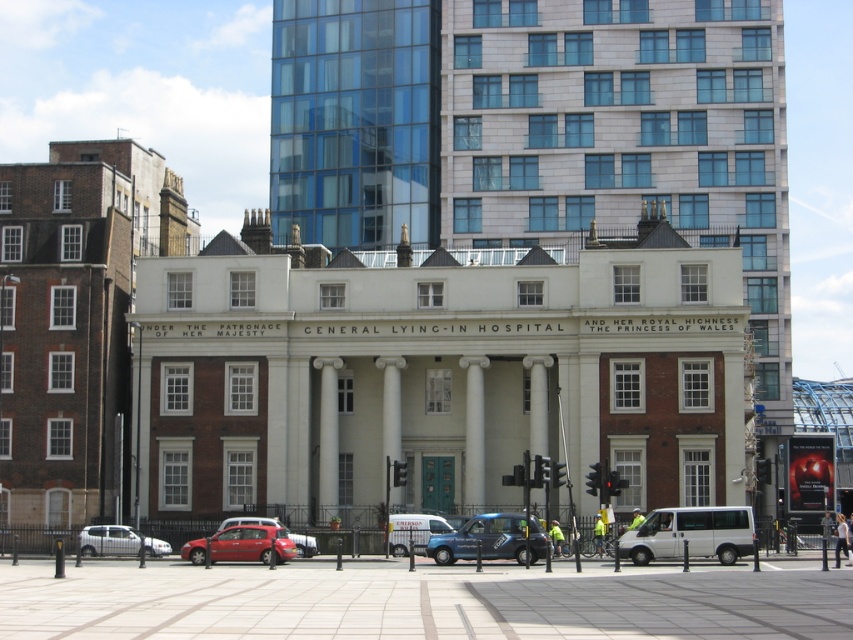
You are a pedestrian standing on the sidewalk in front of the GENERAL LYING IN HOSPITAL. You see a metallic red car at center and a shiny red car at center. Which car is closer to the hospital entrance?

The shiny red car at center is closer to the hospital entrance because the metallic red car at center is positioned on the right side of it, meaning the shiny red car is between the pedestrian and the entrance.

You are a pedestrian standing on the sidewalk in front of the GENERAL LYING IN HOSPITAL. You see a white matte van at center and a metallic red car at center. Which vehicle is closer to you?

The white matte van at center is closer to you because it is in front of the metallic red car at center.